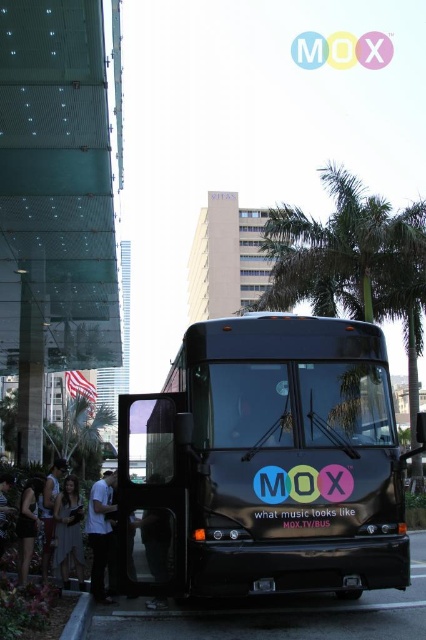
Does white cotton shirt at center appear under matte black dress at lower left?

No, white cotton shirt at center is not below matte black dress at lower left.

Is white cotton shirt at center to the right of matte black dress at lower left from the viewer's perspective?

Yes, white cotton shirt at center is to the right of matte black dress at lower left.

Does point (94, 563) lie behind point (51, 467)?

No, (94, 563) is in front of (51, 467).

Where is `white cotton shirt at center`? white cotton shirt at center is located at coordinates (100, 531).

Who is shorter, matte black dress at lower left or gray concrete curb at lower left?

gray concrete curb at lower left

Does matte black dress at lower left have a larger size compared to gray concrete curb at lower left?

Indeed, matte black dress at lower left has a larger size compared to gray concrete curb at lower left.

What are the coordinates of `matte black dress at lower left` in the screenshot? It's located at (49, 509).

Does green leafy palm tree at center have a greater height compared to matte black dress at lower left?

Yes, green leafy palm tree at center is taller than matte black dress at lower left.

Does green leafy palm tree at center have a larger size compared to matte black dress at lower left?

Yes.

Does point (336, 237) lie in front of point (54, 493)?

No, (336, 237) is behind (54, 493).

Find the location of `green leafy palm tree at center`. green leafy palm tree at center is located at coordinates tap(351, 260).